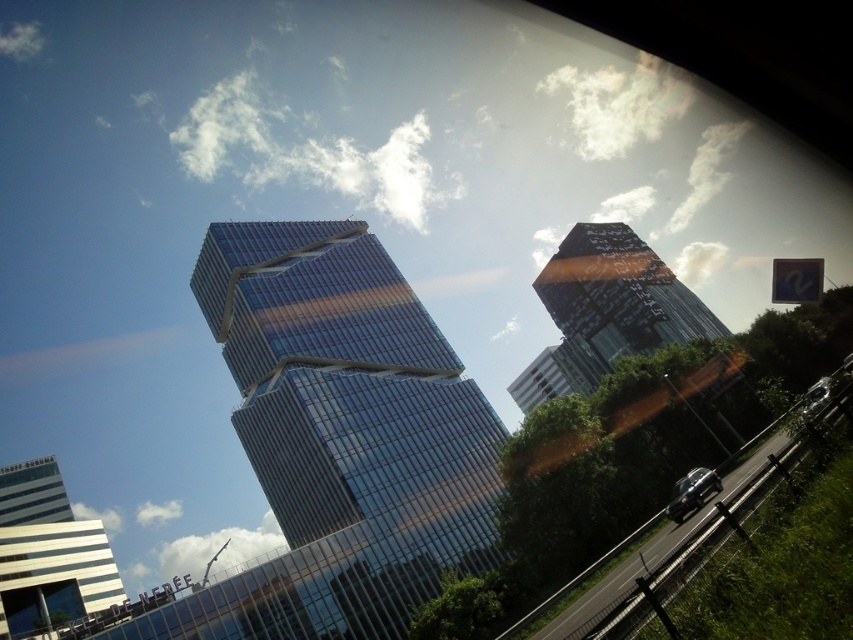
You are a drone operator who needs to fly a drone from the glassy metallic skyscraper at center to the black asphalt highway at lower right. Considering the height difference between them, will the drone have to ascend or descend during the flight?

The glassy metallic skyscraper at center is taller than the black asphalt highway at lower right, so the drone will have to descend during the flight.

Based on the photo, you are a city planner analyzing the urban layout. Considering the glassy metallic skyscraper at center and the black asphalt highway at lower right, which one occupies more space in the image?

The glassy metallic skyscraper at center has a larger size compared to the black asphalt highway at lower right, so it occupies more space in the image.

You are a drone operator trying to capture a photo of the glassy metallic skyscraper at center and the black asphalt highway at lower right. From your current position, which object is closer to the camera?

The black asphalt highway at lower right is closer to the camera because the glassy metallic skyscraper at center is positioned over it, indicating it is further away.